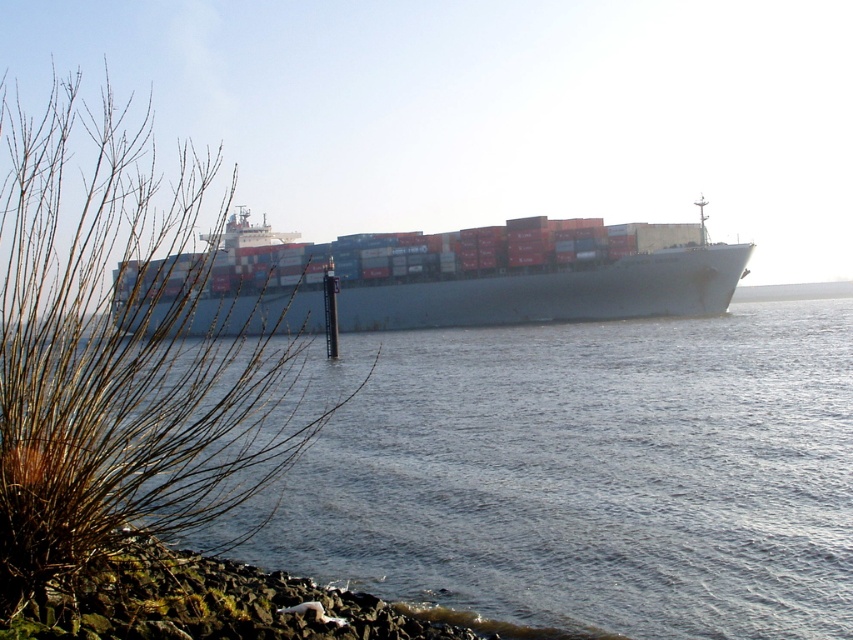
Question: Which of the following is the farthest from the observer?

Choices:
 (A) brown dry grass at left
 (B) gray water at center

Answer: (B)

Question: Is gray water at center above blue matte container ship at center?

Choices:
 (A) yes
 (B) no

Answer: (B)

Question: Does brown dry grass at left have a larger size compared to blue matte container ship at center?

Choices:
 (A) no
 (B) yes

Answer: (B)

Question: Which point is farther to the camera?

Choices:
 (A) (62, 582)
 (B) (316, 461)

Answer: (B)

Question: Where is gray water at center located in relation to brown dry grass at left in the image?

Choices:
 (A) left
 (B) right

Answer: (B)

Question: Which object is closer to the camera taking this photo?

Choices:
 (A) blue matte container ship at center
 (B) brown dry grass at left

Answer: (A)